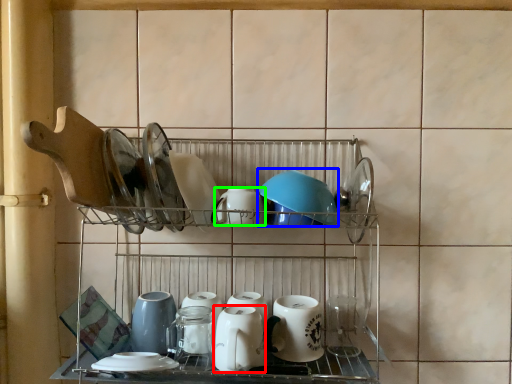
Question: Which object is the closest to the tableware (highlighted by a red box)? Choose among these: tableware (highlighted by a blue box) or tableware (highlighted by a green box).

Choices:
 (A) tableware
 (B) tableware

Answer: (B)